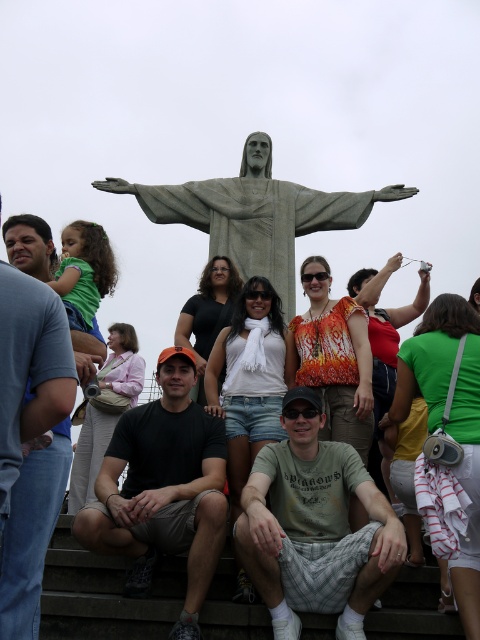
Is point (338, 392) positioned after point (133, 376)?

No, (338, 392) is in front of (133, 376).

Is printed cotton blouse at center wider than pink fabric purse at center?

Yes, printed cotton blouse at center is wider than pink fabric purse at center.

Does point (360, 364) come closer to viewer compared to point (129, 339)?

Yes, point (360, 364) is in front of point (129, 339).

In order to click on printed cotton blouse at center in this screenshot , I will do `click(333, 358)`.

Is orange printed blouse at center bigger than black fabric shirt at center?

Correct, orange printed blouse at center is larger in size than black fabric shirt at center.

Is orange printed blouse at center above black fabric shirt at center?

No, orange printed blouse at center is not above black fabric shirt at center.

Where is `orange printed blouse at center`? orange printed blouse at center is located at coordinates (384, 340).

Where is `green fabric bag at right`? The width and height of the screenshot is (480, 640). green fabric bag at right is located at coordinates (450, 420).

Can you confirm if green fabric bag at right is smaller than black fabric shirt at center?

No.

Where is `green fabric bag at right`? The width and height of the screenshot is (480, 640). green fabric bag at right is located at coordinates (450, 420).

Where is `green fabric bag at right`? green fabric bag at right is located at coordinates (450, 420).